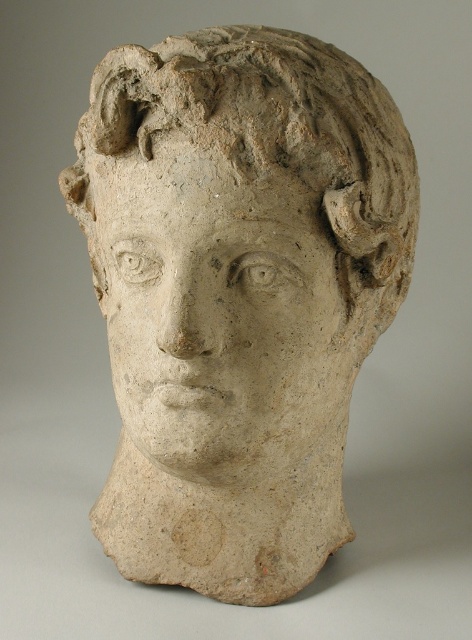
Question: Observing the image, what is the correct spatial positioning of matte clay head at center in reference to matte stone face at center?

Choices:
 (A) below
 (B) above

Answer: (B)

Question: Observing the image, what is the correct spatial positioning of matte clay head at center in reference to matte stone face at center?

Choices:
 (A) left
 (B) right

Answer: (B)

Question: Which point appears closest to the camera in this image?

Choices:
 (A) (185, 211)
 (B) (236, 273)

Answer: (A)

Question: Does matte clay head at center appear over matte stone face at center?

Choices:
 (A) no
 (B) yes

Answer: (B)